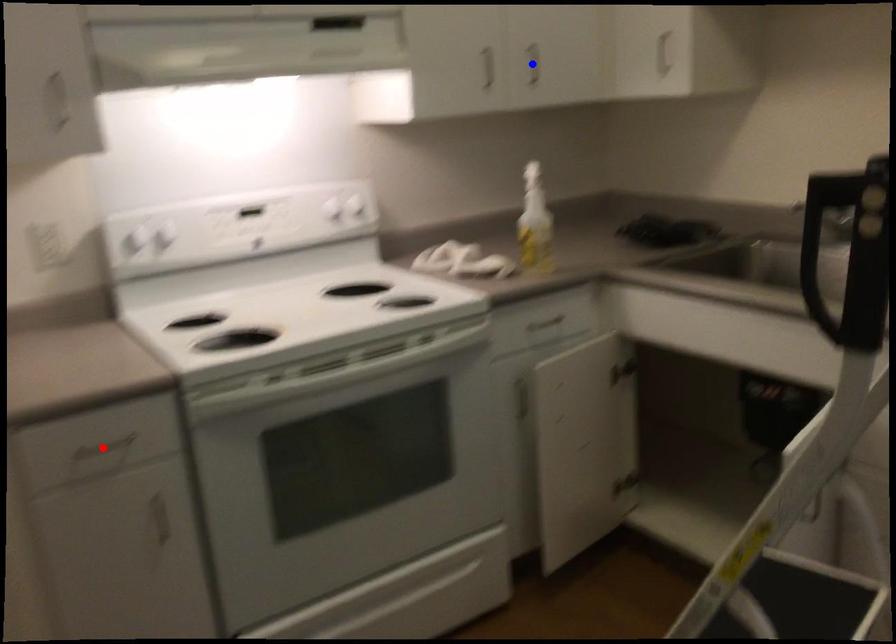
Question: Two points are marked on the image. Which point is closer to the camera?

Choices:
 (A) Blue point is closer.
 (B) Red point is closer.

Answer: (B)